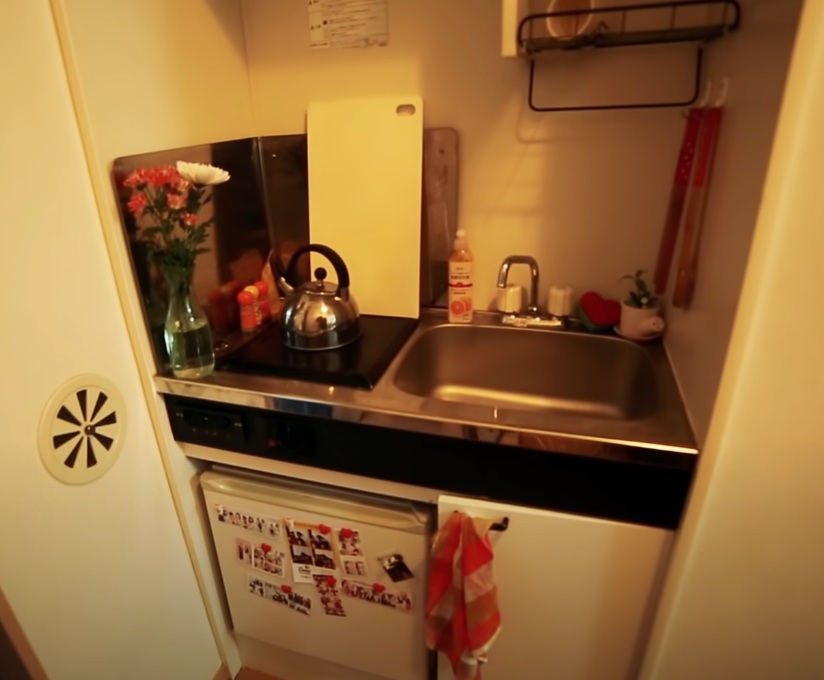
I want to click on hand towel, so click(x=471, y=596).